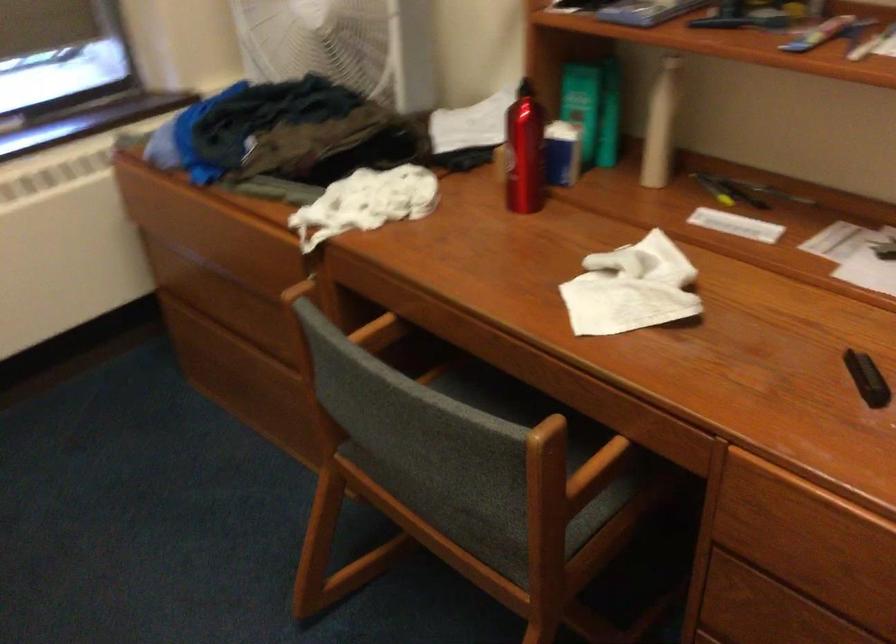
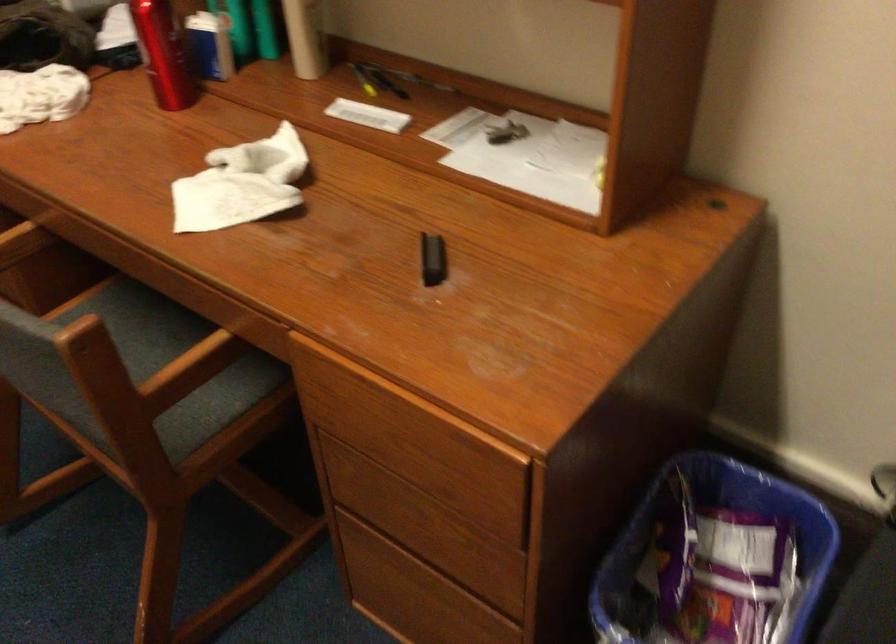
Question: The camera is either moving clockwise (left) or counter-clockwise (right) around the object. The first image is from the beginning of the video and the second image is from the end. Is the camera moving left or right when shooting the video?

Choices:
 (A) Left
 (B) Right

Answer: (A)